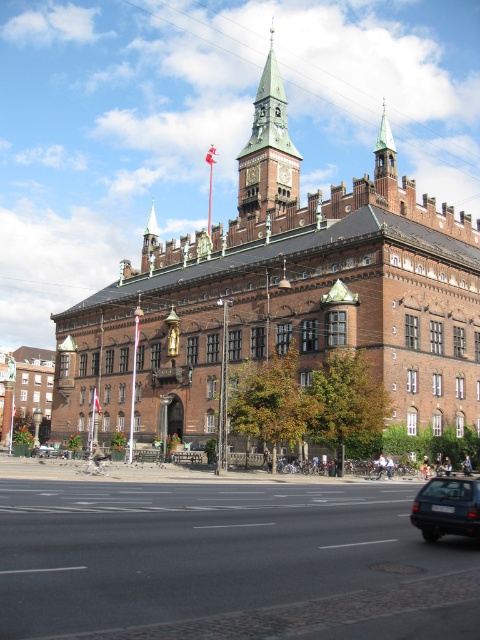
You are a photographer standing on the sidewalk in front of the historic building. You want to take a photo that includes both the green copper clock tower at upper center and the blue metallic car at lower right. Which object should you position closer to the left side of your camera frame?

The green copper clock tower at upper center should be positioned closer to the left side of your camera frame because it is already on the left side of the blue metallic car at lower right.

You are a delivery person needing to park your vehicle in this area. You have a blue metallic car at lower right and a metallic silver car at center. Which car has a narrower width, and would require less space to park?

The blue metallic car at lower right has a lesser width compared to the metallic silver car at center, so it would require less space to park.